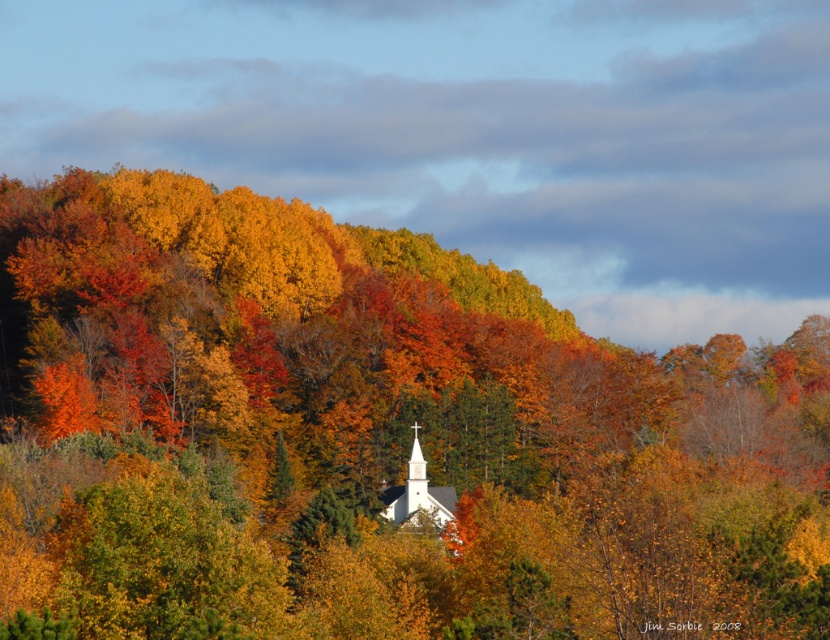
Question: Is matte orange tree at center positioned at the back of white smooth chapel at center?

Choices:
 (A) no
 (B) yes

Answer: (A)

Question: Among these objects, which one is nearest to the camera?

Choices:
 (A) white smooth chapel at center
 (B) matte orange tree at center

Answer: (B)

Question: Which point appears closest to the camera in this image?

Choices:
 (A) (417, 440)
 (B) (267, 353)

Answer: (A)

Question: Does matte orange tree at center have a smaller size compared to white smooth chapel at center?

Choices:
 (A) yes
 (B) no

Answer: (B)

Question: Can you confirm if matte orange tree at center is thinner than white smooth chapel at center?

Choices:
 (A) no
 (B) yes

Answer: (A)

Question: Among these points, which one is farthest from the camera?

Choices:
 (A) (384, 499)
 (B) (426, 545)

Answer: (A)